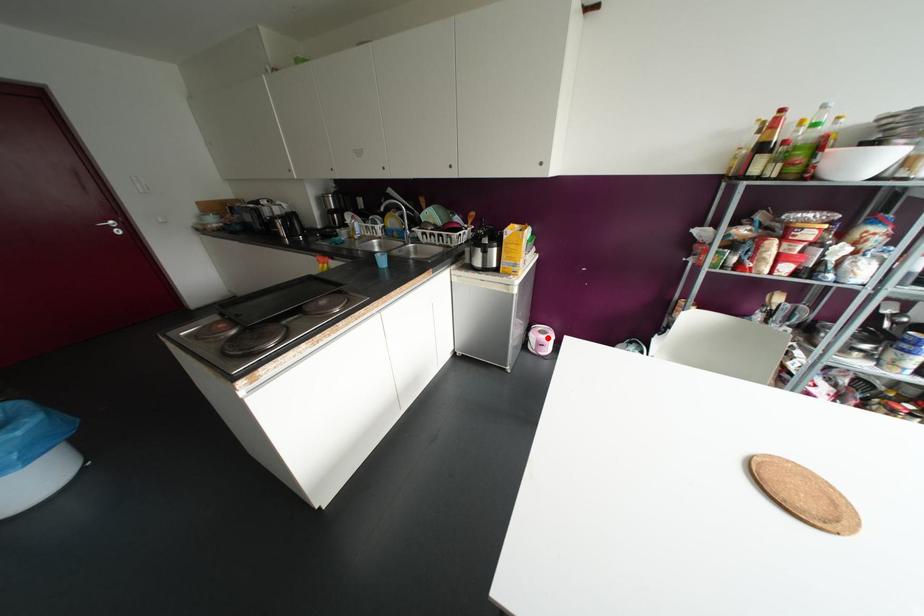
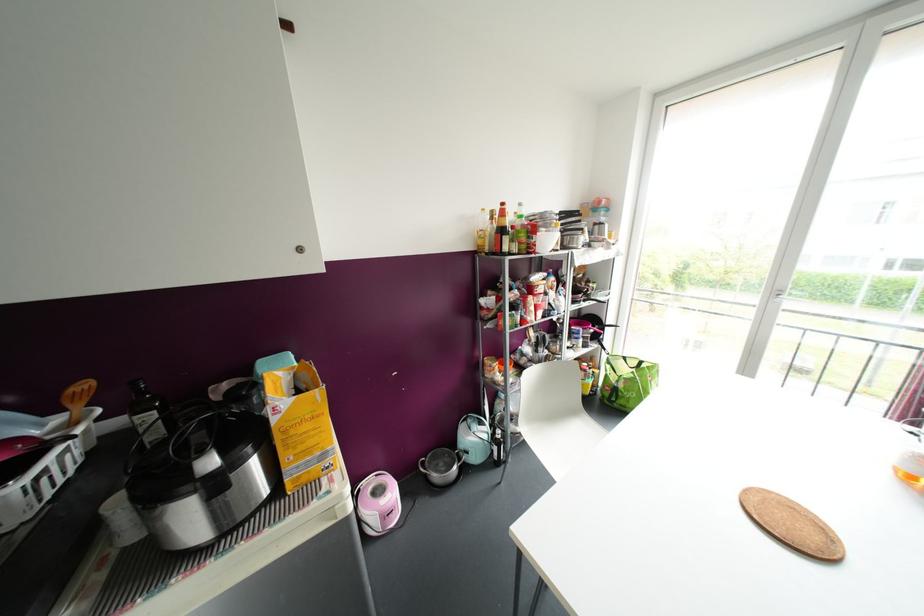
Find the pixel in the second image that matches the highlighted location in the first image.

(392, 493)